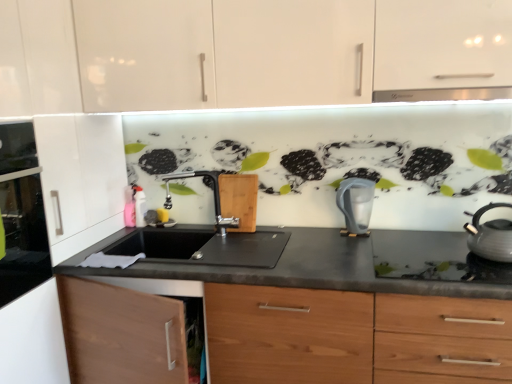
Question: Can you confirm if matte gray kettle at right, which is the first kitchen appliance in front-to-back order, is positioned to the left of satin nickel faucet at center?

Choices:
 (A) yes
 (B) no

Answer: (B)

Question: Is the position of matte gray kettle at right, the 1th kitchen appliance positioned from the right, more distant than that of satin nickel faucet at center?

Choices:
 (A) no
 (B) yes

Answer: (A)

Question: Can you see matte gray kettle at right, acting as the second kitchen appliance starting from the back, touching satin nickel faucet at center?

Choices:
 (A) no
 (B) yes

Answer: (A)

Question: From a real-world perspective, is matte gray kettle at right, which is the first kitchen appliance in front-to-back order, located higher than satin nickel faucet at center?

Choices:
 (A) no
 (B) yes

Answer: (A)

Question: Can you confirm if matte gray kettle at right, which is the first kitchen appliance in front-to-back order, is wider than satin nickel faucet at center?

Choices:
 (A) yes
 (B) no

Answer: (A)

Question: Does matte gray kettle at right, acting as the second kitchen appliance starting from the back, have a greater height compared to satin nickel faucet at center?

Choices:
 (A) yes
 (B) no

Answer: (B)

Question: From a real-world perspective, is satin nickel faucet at center physically above glass door oven at left?

Choices:
 (A) yes
 (B) no

Answer: (B)

Question: Can you confirm if satin nickel faucet at center is smaller than glass door oven at left?

Choices:
 (A) no
 (B) yes

Answer: (B)

Question: From the image's perspective, is satin nickel faucet at center below glass door oven at left?

Choices:
 (A) no
 (B) yes

Answer: (A)

Question: Can you confirm if satin nickel faucet at center is shorter than glass door oven at left?

Choices:
 (A) no
 (B) yes

Answer: (B)

Question: Is satin nickel faucet at center far away from glass door oven at left?

Choices:
 (A) yes
 (B) no

Answer: (B)

Question: Is satin nickel faucet at center to the left of glass door oven at left from the viewer's perspective?

Choices:
 (A) no
 (B) yes

Answer: (A)

Question: Does white glossy gas stove at right have a larger size compared to black matte countertop at center?

Choices:
 (A) no
 (B) yes

Answer: (A)